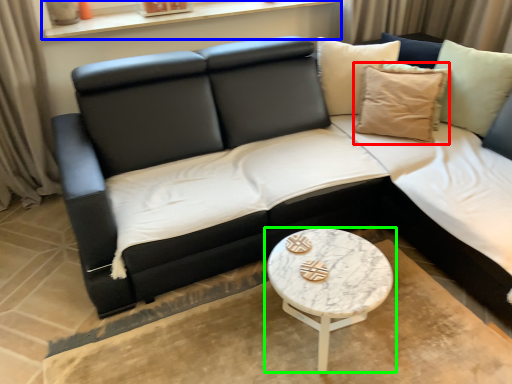
Question: Estimate the real-world distances between objects in this image. Which object is farther from pillow (highlighted by a red box), window sill (highlighted by a blue box) or coffee table (highlighted by a green box)?

Choices:
 (A) window sill
 (B) coffee table

Answer: (A)